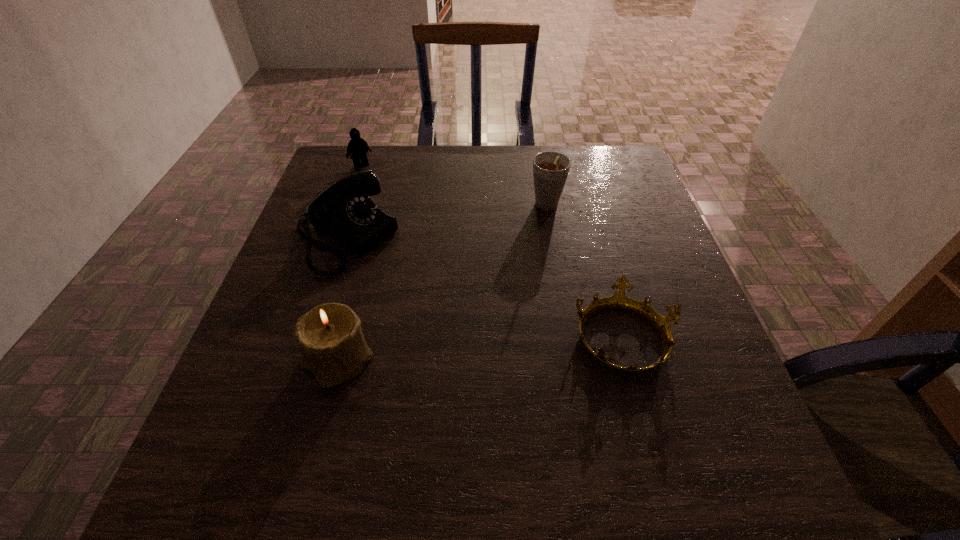
I want to click on free point between the candle_holder and the telephone, so pyautogui.click(x=342, y=300).

The width and height of the screenshot is (960, 540). Identify the location of empty space between the root beer and the Lego. (454, 187).

Find the location of a particular element. The height and width of the screenshot is (540, 960). free space between the shortest object and the telephone is located at coordinates (484, 288).

The width and height of the screenshot is (960, 540). Identify the location of unoccupied position between the root beer and the telephone. (446, 224).

At what (x,y) coordinates should I click in order to perform the action: click on vacant area between the candle_holder and the root beer. Please return your answer as a coordinate pair (x, y). Looking at the image, I should click on (443, 285).

Find the location of `free space between the root beer and the third shortest object`. free space between the root beer and the third shortest object is located at coordinates (446, 224).

The width and height of the screenshot is (960, 540). What are the coordinates of `unoccupied position between the crown and the root beer` in the screenshot? It's located at (585, 273).

Where is `free spot between the root beer and the farthest object`? free spot between the root beer and the farthest object is located at coordinates (454, 187).

The width and height of the screenshot is (960, 540). Identify the location of object that is the fourth closest to the shortest object. (358, 147).

You are a GUI agent. You are given a task and a screenshot of the screen. Output one action in this format:
    pyautogui.click(x=<x>, y=<y>)
    Task: Click on the second closest object to the second shortest object
    Image resolution: width=960 pixels, height=540 pixels.
    Given the screenshot: What is the action you would take?
    pos(550,168)